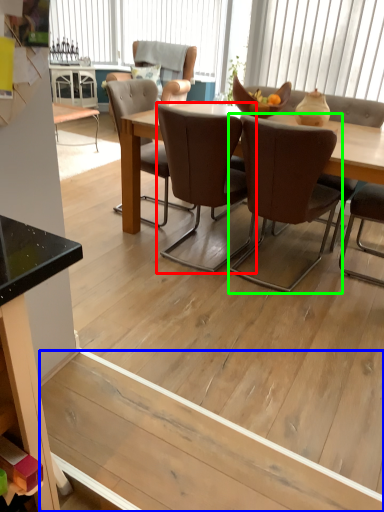
Question: Which object is positioned farthest from chair (highlighted by a red box)? Select from plywood (highlighted by a blue box) and chair (highlighted by a green box).

Choices:
 (A) plywood
 (B) chair

Answer: (A)